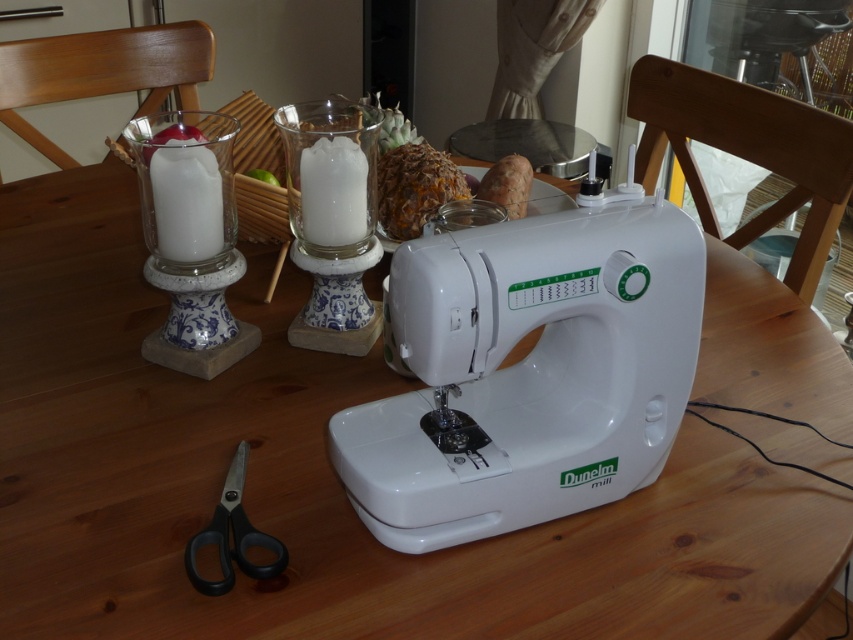
Question: Does white ceramic candle holder at left have a larger size compared to black plastic scissors at lower left?

Choices:
 (A) yes
 (B) no

Answer: (A)

Question: Which of the following is the closest to the observer?

Choices:
 (A) (368, 180)
 (B) (242, 568)
 (C) (213, 291)

Answer: (B)

Question: Can you confirm if white glass candle holder at center is positioned below black plastic scissors at lower left?

Choices:
 (A) no
 (B) yes

Answer: (A)

Question: Which point is closer to the camera?

Choices:
 (A) white plastic sewing machine at center
 (B) white glass candle holder at center

Answer: (A)

Question: Which of the following is the farthest from the observer?

Choices:
 (A) (369, 168)
 (B) (512, 225)
 (C) (268, 564)
 (D) (229, 333)

Answer: (D)

Question: Can you confirm if white plastic sewing machine at center is smaller than black plastic scissors at lower left?

Choices:
 (A) yes
 (B) no

Answer: (B)